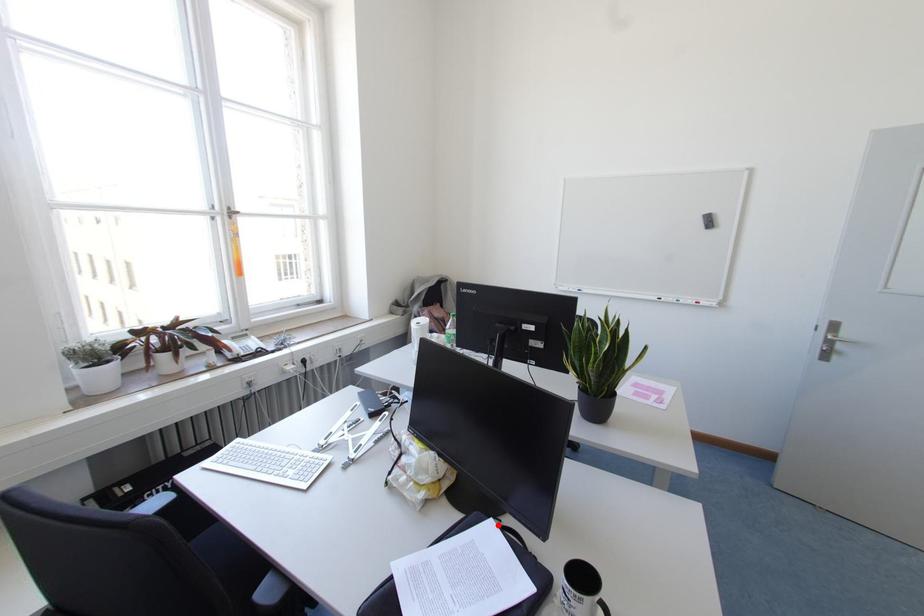
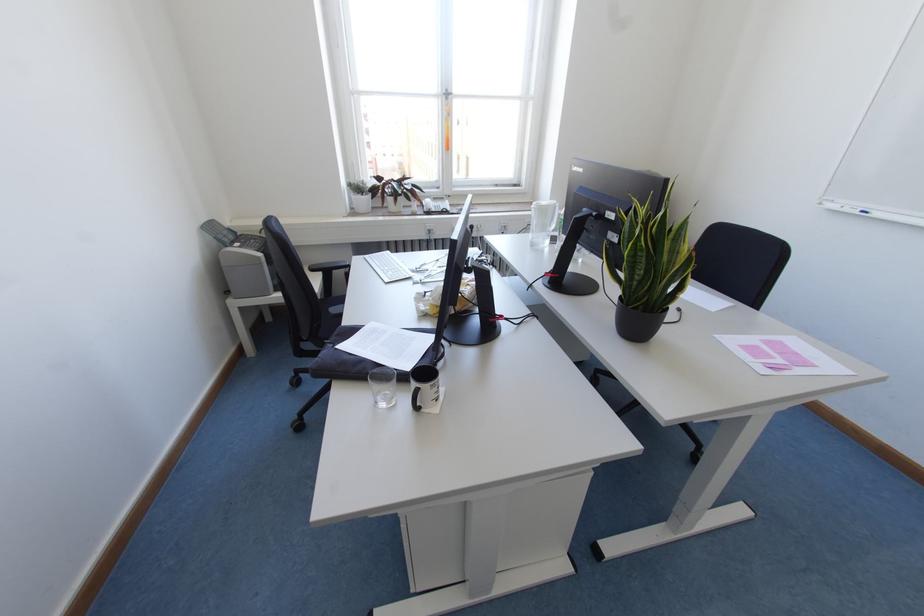
The point at the highlighted location is marked in the first image. Where is the corresponding point in the second image?

(433, 338)